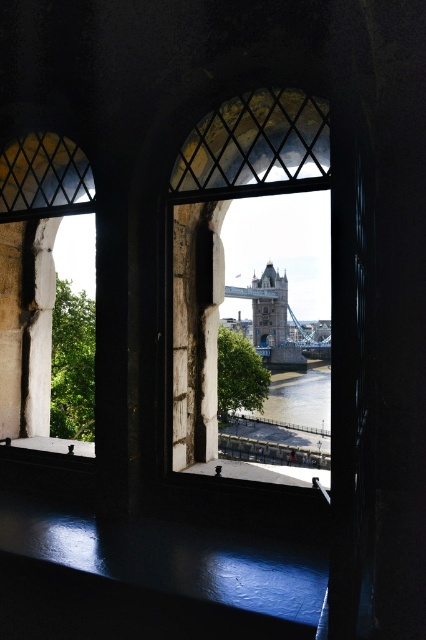
Is clear glass window at center closer to the viewer compared to matte stone window at left?

Yes, clear glass window at center is in front of matte stone window at left.

Is the position of clear glass window at center more distant than that of matte stone window at left?

No, it is in front of matte stone window at left.

Between point (195, 369) and point (9, 435), which one is positioned behind?

Point (9, 435)

In order to click on clear glass window at center in this screenshot , I will do `click(219, 232)`.

Who is positioned more to the left, matte stone window at left or brown water at lower center?

From the viewer's perspective, matte stone window at left appears more on the left side.

Is matte stone window at left below brown water at lower center?

Actually, matte stone window at left is above brown water at lower center.

Which is behind, point (22, 220) or point (275, 396)?

The point (275, 396) is behind.

You are a GUI agent. You are given a task and a screenshot of the screen. Output one action in this format:
    pyautogui.click(x=<x>, y=<y>)
    Task: Click on the matte stone window at left
    Image resolution: width=426 pixels, height=640 pixels.
    Given the screenshot: What is the action you would take?
    pyautogui.click(x=32, y=268)

Can you confirm if matte stone window at left is thinner than blue stone tower bridge at center?

Indeed, matte stone window at left has a lesser width compared to blue stone tower bridge at center.

Between point (16, 266) and point (268, 324), which one is positioned in front?

Positioned in front is point (16, 266).

You are a GUI agent. You are given a task and a screenshot of the screen. Output one action in this format:
    pyautogui.click(x=<x>, y=<y>)
    Task: Click on the matte stone window at left
    
    Given the screenshot: What is the action you would take?
    pyautogui.click(x=32, y=268)